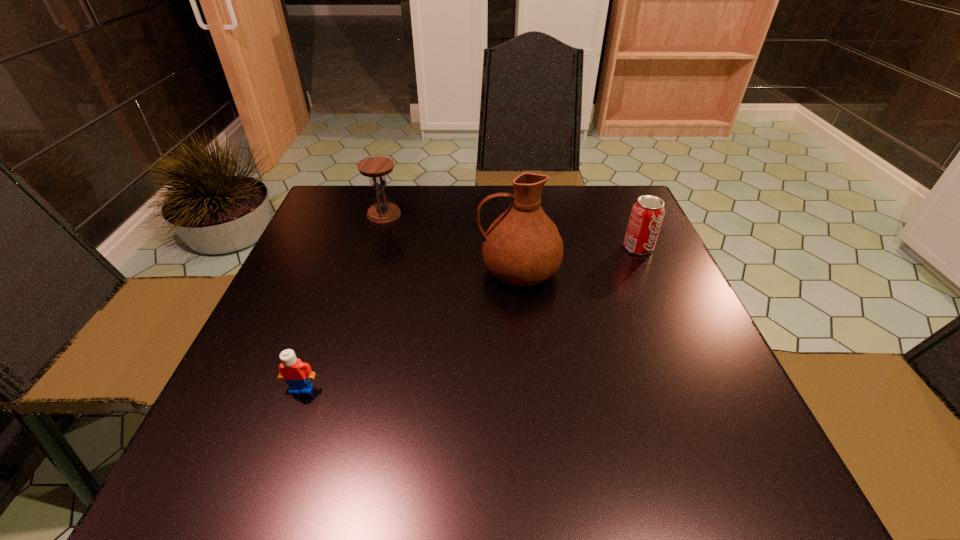
The width and height of the screenshot is (960, 540). In order to click on vacant space positioned on the front of the soda can in this screenshot , I will do `click(652, 279)`.

Find the location of a particular element. Image resolution: width=960 pixels, height=540 pixels. free space located on the face of the nearest object is located at coordinates (266, 488).

Where is `object at the far edge`? The height and width of the screenshot is (540, 960). object at the far edge is located at coordinates (382, 212).

Where is `hourglass that is at the left edge`? The height and width of the screenshot is (540, 960). hourglass that is at the left edge is located at coordinates (382, 212).

You are a GUI agent. You are given a task and a screenshot of the screen. Output one action in this format:
    pyautogui.click(x=<x>, y=<y>)
    Task: Click on the Lego that is at the left edge
    
    Given the screenshot: What is the action you would take?
    pyautogui.click(x=297, y=374)

Locate an element on the screen. object located at the right edge is located at coordinates (647, 213).

Locate an element on the screen. The height and width of the screenshot is (540, 960). object present at the far left corner is located at coordinates (382, 212).

Where is `free space at the far edge of the desktop`? The width and height of the screenshot is (960, 540). free space at the far edge of the desktop is located at coordinates (439, 214).

At what (x,y) coordinates should I click in order to perform the action: click on free region at the near edge. Please return your answer as a coordinate pair (x, y). The height and width of the screenshot is (540, 960). Looking at the image, I should click on (621, 472).

At what (x,y) coordinates should I click in order to perform the action: click on free space at the left edge of the desktop. Please return your answer as a coordinate pair (x, y). Looking at the image, I should click on (304, 286).